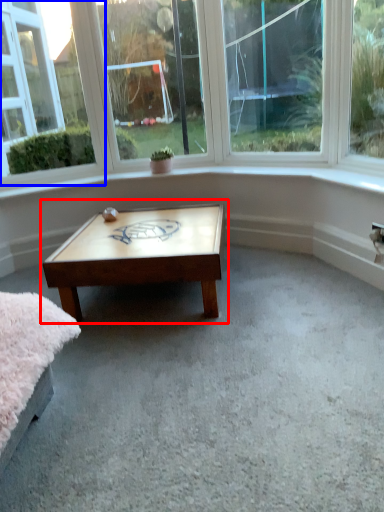
Question: Which of the following is the farthest to the observer, coffee table (highlighted by a red box) or window (highlighted by a blue box)?

Choices:
 (A) coffee table
 (B) window

Answer: (B)